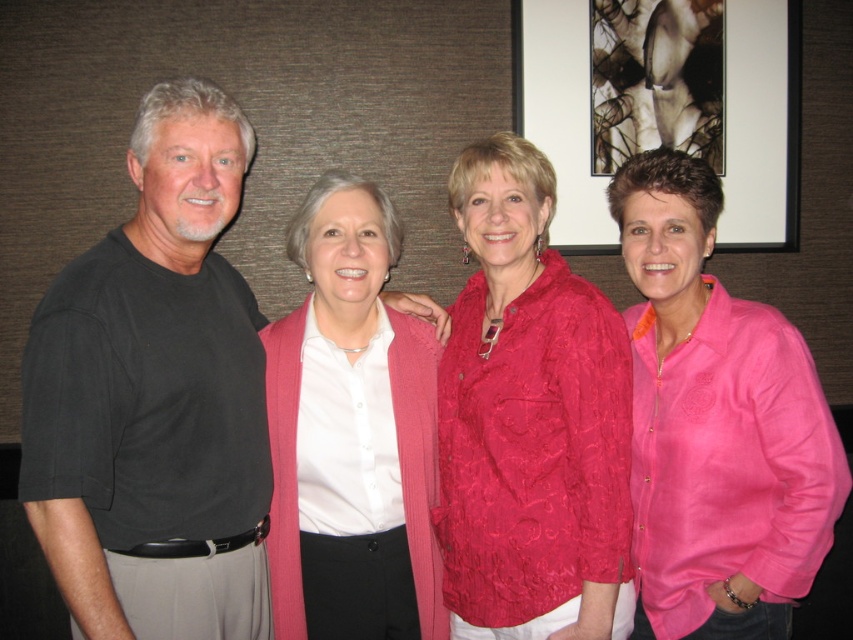
What do you see at coordinates (717, 426) in the screenshot? I see `pink satin blouse at right` at bounding box center [717, 426].

Does pink satin blouse at right have a greater height compared to pink knitted cardigan at center?

Correct, pink satin blouse at right is much taller as pink knitted cardigan at center.

From the picture: Who is more forward, (706, 628) or (310, 556)?

Positioned in front is point (706, 628).

The width and height of the screenshot is (853, 640). Identify the location of pink satin blouse at right. (717, 426).

Between black cotton t-shirt at left and pink satin blouse at right, which one is positioned higher?

black cotton t-shirt at left

Who is more distant from viewer, (39,317) or (675,433)?

The point (675,433) is behind.

Who is more forward, (183, 547) or (701, 524)?

Positioned in front is point (183, 547).

Image resolution: width=853 pixels, height=640 pixels. Identify the location of black cotton t-shirt at left. (155, 397).

Does black cotton t-shirt at left appear on the right side of black glossy picture frame at upper center?

No, black cotton t-shirt at left is not to the right of black glossy picture frame at upper center.

Between point (126, 225) and point (548, 33), which one is positioned behind?

Positioned behind is point (548, 33).

Where is `black cotton t-shirt at left`? This screenshot has width=853, height=640. black cotton t-shirt at left is located at coordinates (155, 397).